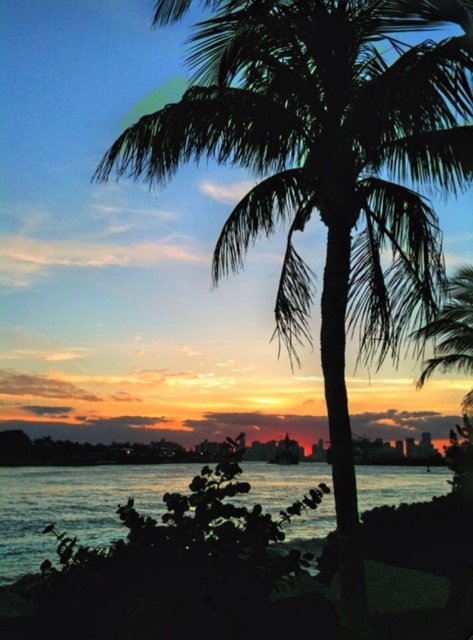
You are standing in front of the palm tree and want to place a 50 foot long wooden pole between the palm tree and the silky orange sky at center. Will the pole fit without bending or breaking?

The distance between the palm tree and the silky orange sky at center is 50.45 feet, so the 50 foot long wooden pole will fit without bending or breaking since it is shorter than the available space.